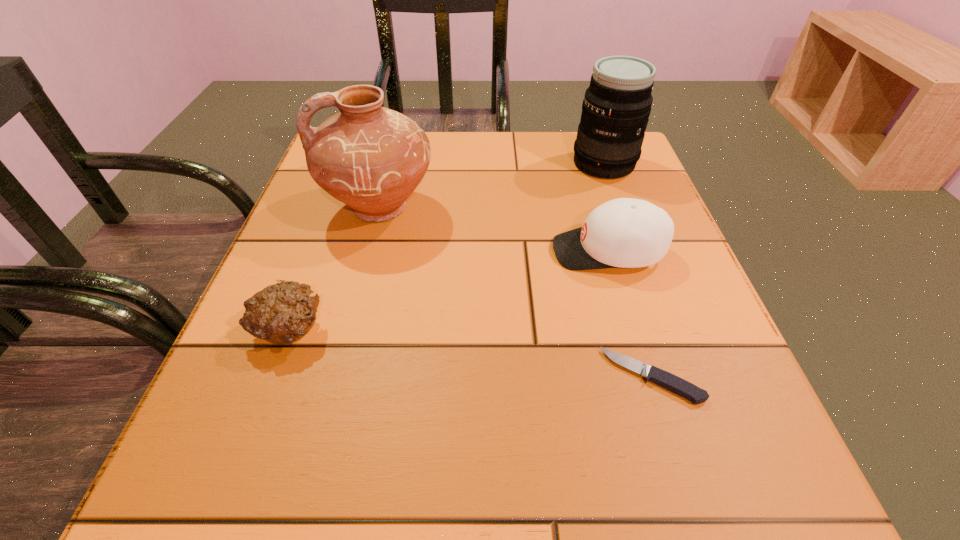
Locate an element on the screen. The image size is (960, 540). object that is at the far right corner is located at coordinates (617, 104).

In the image, there is a desktop. Where is `vacant space at the far edge`? This screenshot has height=540, width=960. vacant space at the far edge is located at coordinates (551, 154).

Locate an element on the screen. The image size is (960, 540). vacant region at the near edge of the desktop is located at coordinates (620, 476).

In the image, there is a desktop. Where is `vacant region at the left edge`? The image size is (960, 540). vacant region at the left edge is located at coordinates (345, 268).

Locate an element on the screen. This screenshot has height=540, width=960. vacant area at the right edge is located at coordinates (706, 330).

This screenshot has width=960, height=540. Find the location of `vacant space at the near right corner of the desktop`. vacant space at the near right corner of the desktop is located at coordinates (763, 509).

The height and width of the screenshot is (540, 960). I want to click on free space that is in between the pottery and the third shortest object, so click(493, 230).

Image resolution: width=960 pixels, height=540 pixels. I want to click on vacant space that is in between the steak knife and the muffin, so click(470, 353).

Identify the location of free area in between the steak knife and the muffin. point(470,353).

Locate an element on the screen. This screenshot has height=540, width=960. vacant area that lies between the third shortest object and the steak knife is located at coordinates (630, 313).